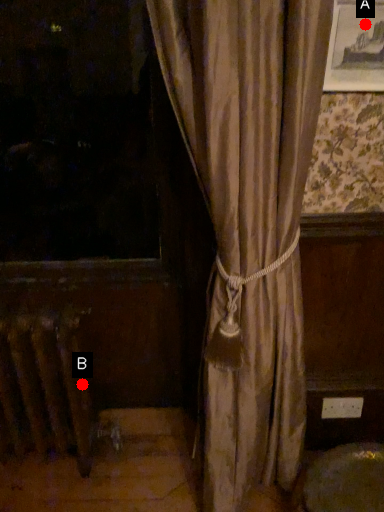
Question: Two points are circled on the image, labeled by A and B beside each circle. Which of the following is the farthest from the observer?

Choices:
 (A) A is further
 (B) B is further

Answer: (B)